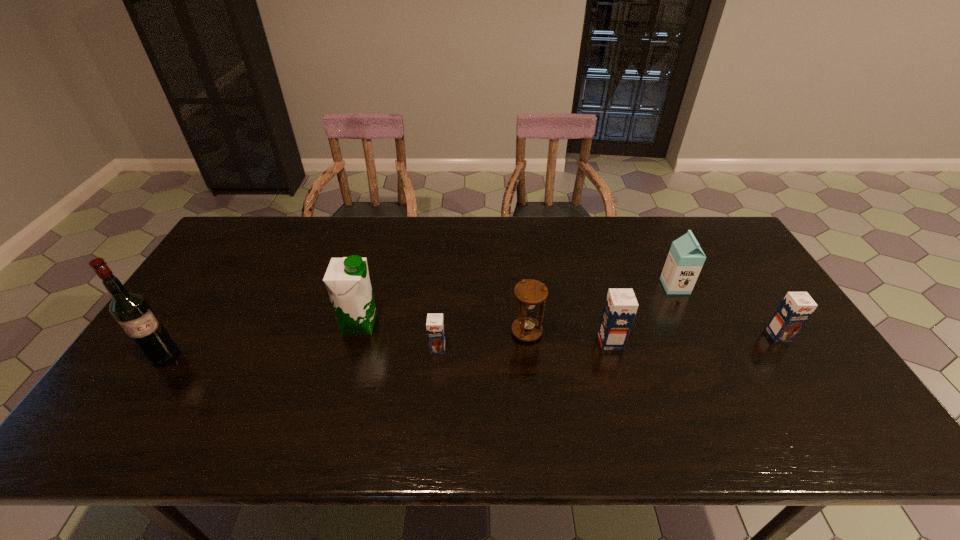
Find the location of `vacant area between the sixth object from right to left and the second chocolate milk from right to left`. vacant area between the sixth object from right to left and the second chocolate milk from right to left is located at coordinates (485, 333).

Identify the location of free spot between the milk carton and the second shortest chocolate milk. (727, 310).

The image size is (960, 540). I want to click on free space between the rightmost chocolate milk and the wine bottle, so click(472, 346).

Locate an element on the screen. vacant space in between the farthest object and the second shortest chocolate milk is located at coordinates tap(727, 310).

You are a GUI agent. You are given a task and a screenshot of the screen. Output one action in this format:
    pyautogui.click(x=<x>, y=<y>)
    Task: Click on the vacant area that lies between the second object from right to left and the third object from right to left
    The height and width of the screenshot is (540, 960).
    Given the screenshot: What is the action you would take?
    pyautogui.click(x=642, y=314)

Locate an element on the screen. The image size is (960, 540). object that ranks as the fifth closest to the tallest object is located at coordinates (685, 260).

What are the coordinates of `object that stands as the second closest to the second chocolate milk from right to left` in the screenshot? It's located at (685, 260).

Identify the location of chocolate milk identified as the second closest to the tallest chocolate milk. (435, 323).

This screenshot has height=540, width=960. In order to click on the second closest chocolate milk to the leftmost object in this screenshot , I will do `click(620, 308)`.

The height and width of the screenshot is (540, 960). I want to click on free location that satisfies the following two spatial constraints: 1. on the front side of the second object from right to left; 2. on the front label of the fifth object from left to right, so click(702, 342).